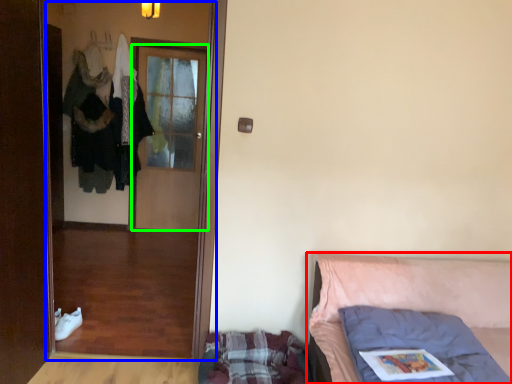
Question: Which is farther away from furniture (highlighted by a red box)? screen door (highlighted by a blue box) or door (highlighted by a green box)?

Choices:
 (A) screen door
 (B) door

Answer: (A)